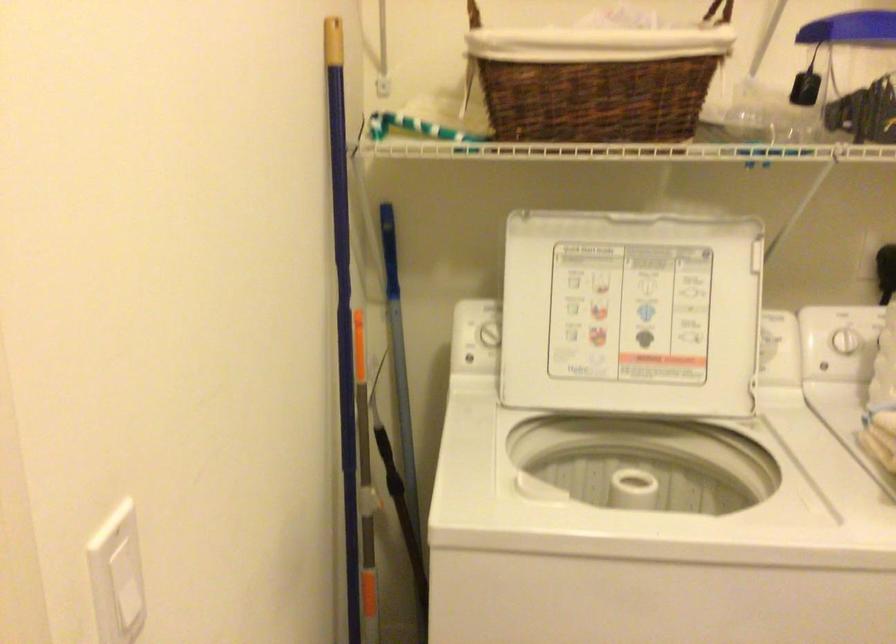
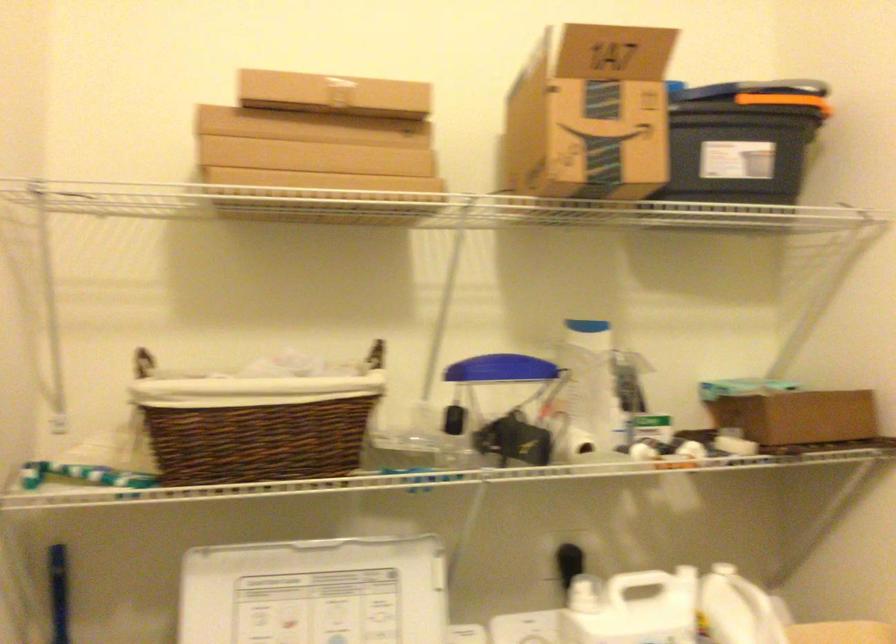
In a continuous first-person perspective shot, in which direction is the camera moving?

The movement direction of the cameraman is right, backward.